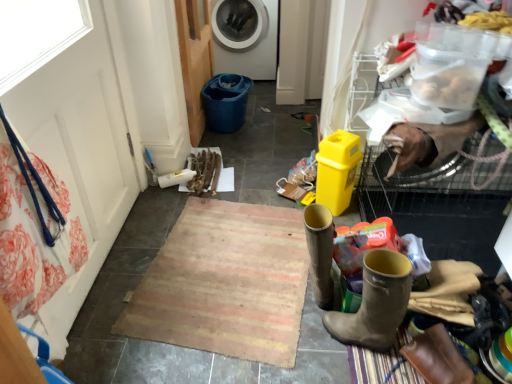
Question: From the image's perspective, is wooden screen door at upper left, marked as the first screen door in a back-to-front arrangement, above or below brown leather boot at lower right, the second footwear in the right-to-left sequence?

Choices:
 (A) below
 (B) above

Answer: (B)

Question: Is wooden screen door at upper left, the 2th screen door viewed from the front, in front of or behind brown leather boot at lower right, the second footwear in the right-to-left sequence, in the image?

Choices:
 (A) behind
 (B) front

Answer: (A)

Question: Estimate the real-world distances between objects in this image. Which object is farther from the brown leather boot at lower right?

Choices:
 (A) brown leather boot at lower right, which is the first footwear in left-to-right order
 (B) rustic woven mat at center
 (C) wooden screen door at upper left, the 2th screen door viewed from the front
 (D) white plastic washing machine at upper center
 (E) brown leather boot at lower right, the 1th footwear viewed from the right

Answer: (D)

Question: Based on their relative distances, which object is farther from the wooden screen door at upper left, the 2th screen door viewed from the front?

Choices:
 (A) white fabric screen door at left, which is counted as the 1th screen door, starting from the left
 (B) rustic woven mat at center
 (C) brown leather boot at lower right
 (D) brown leather boot at lower right, placed as the second footwear when sorted from left to right
 (E) white plastic washing machine at upper center

Answer: (C)